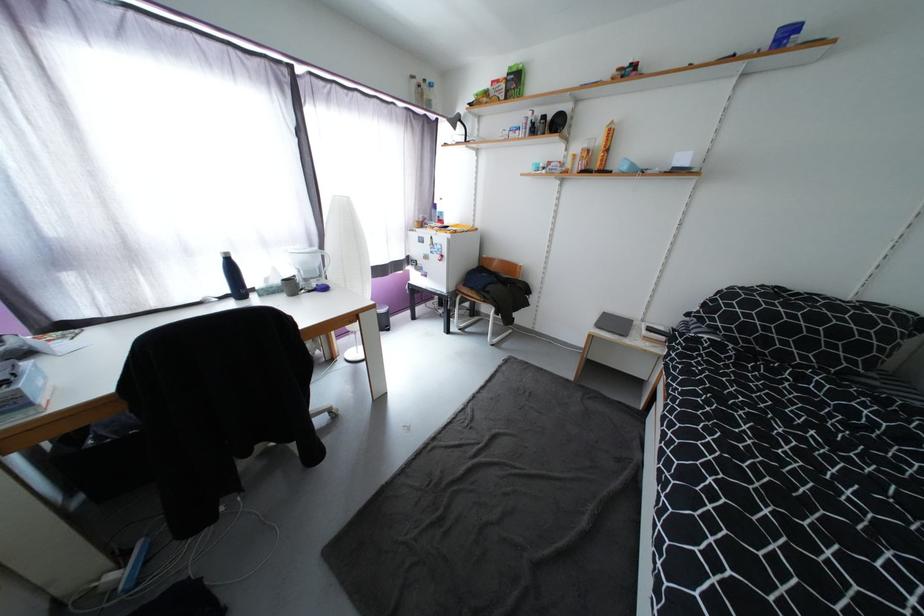
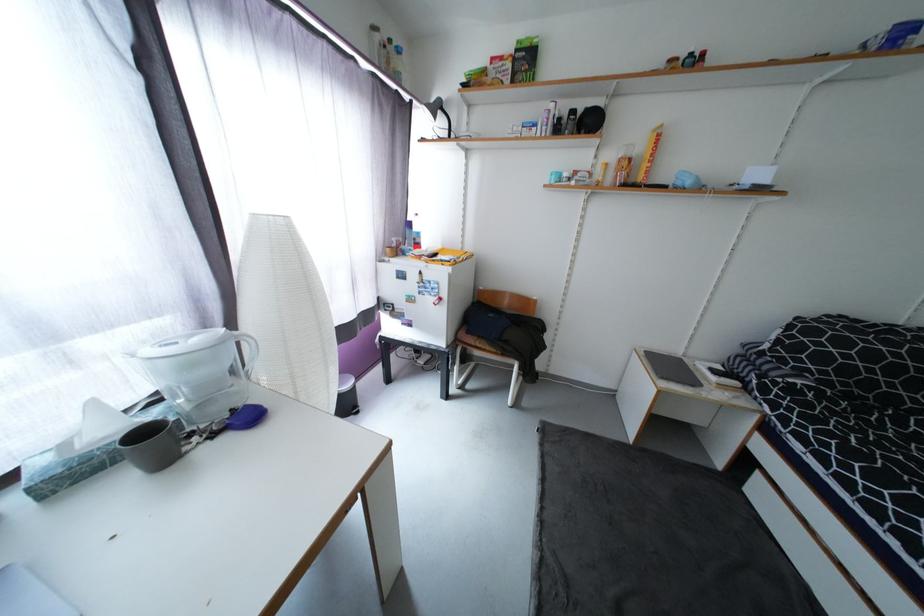
Where in the second image is the point corresponding to point (480, 398) from the first image?

(548, 524)